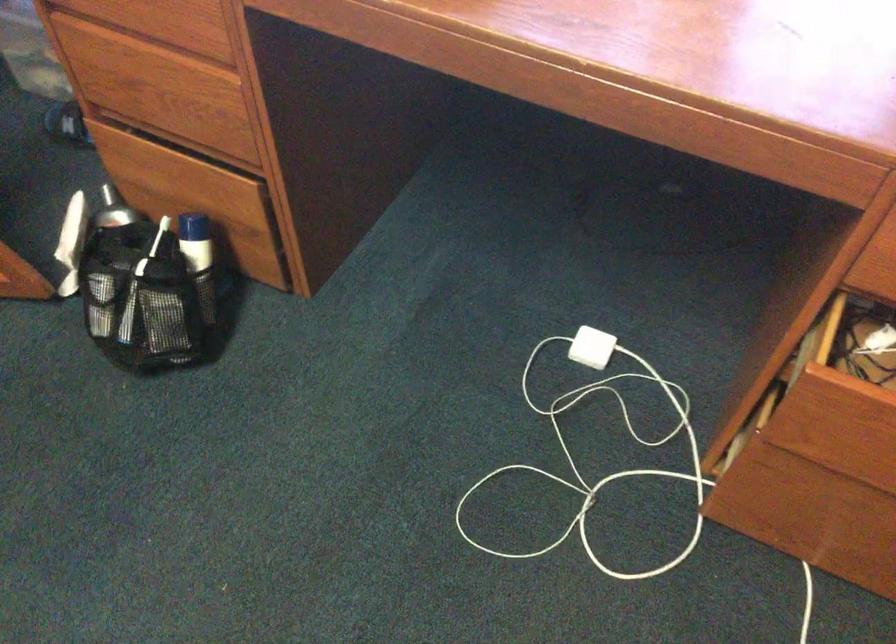
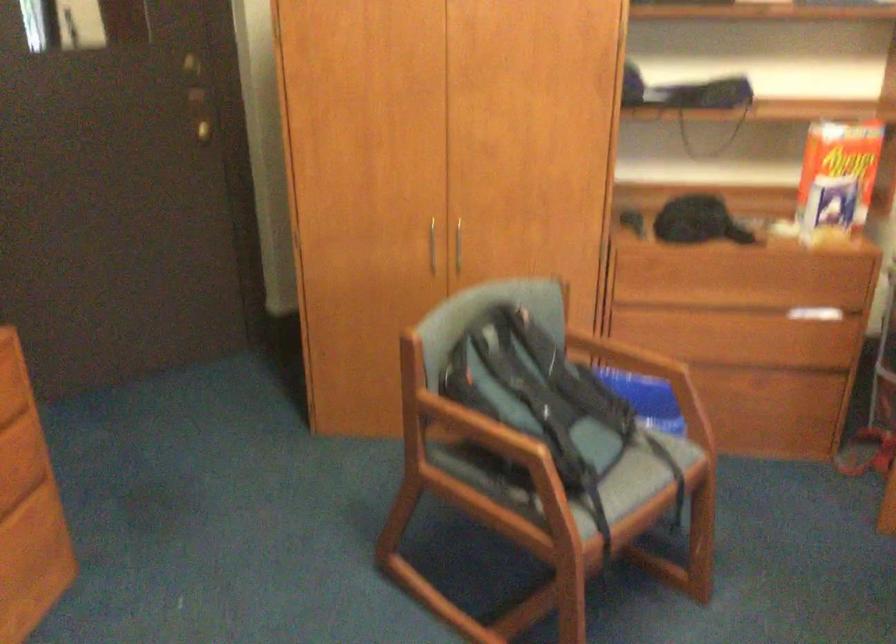
First-person continuous shooting, in which direction is the camera rotating?

The camera's rotation is toward left-down.